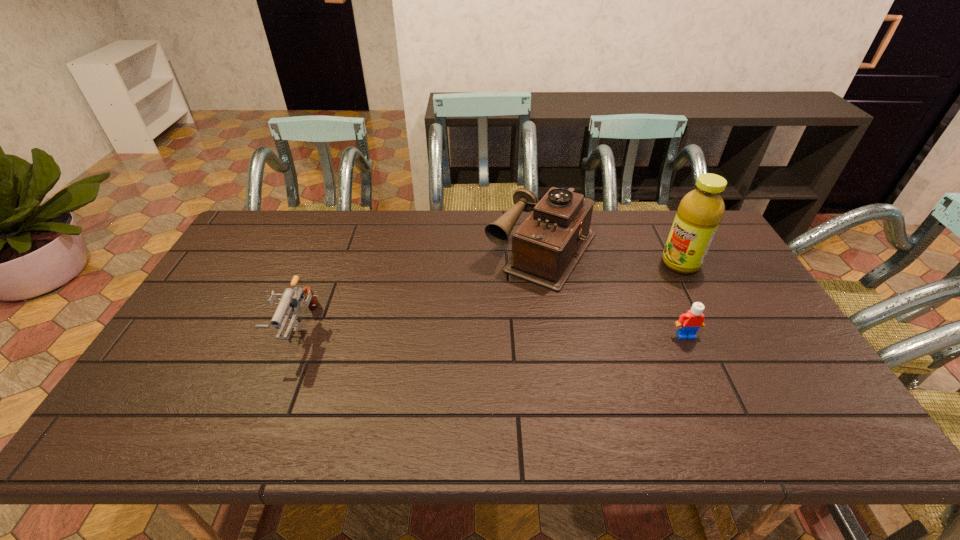
Identify the location of free space on the desktop that is between the leftmost object and the shortest object and is positioned on the horn of the second object from left to right. Image resolution: width=960 pixels, height=540 pixels. (482, 333).

Identify the location of free space on the desktop that is between the leftmost object and the shortest object and is positioned on the front label of the fruit juice. (540, 333).